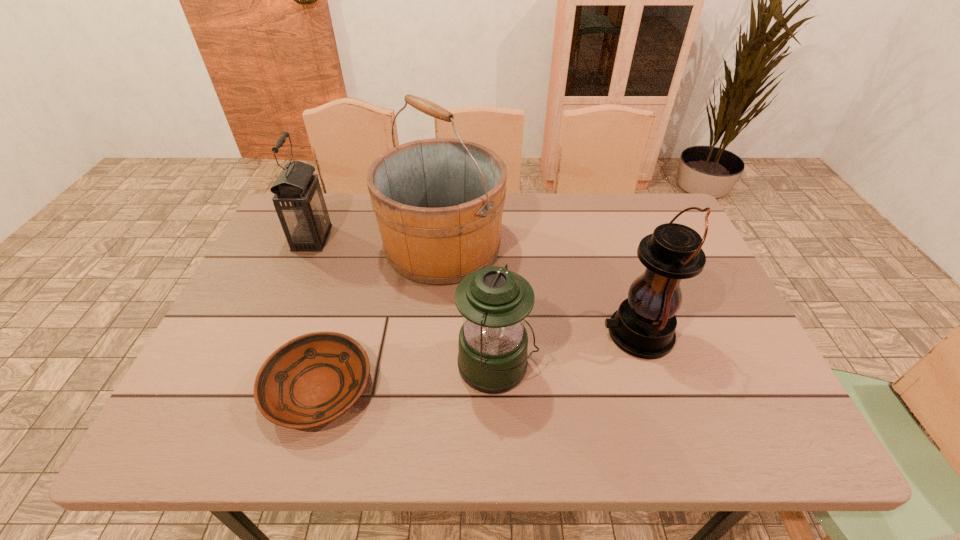
Locate an element on the screen. The height and width of the screenshot is (540, 960). vacant area situated 0.160m on the front-facing side of the leftmost lantern is located at coordinates (386, 238).

What are the coordinates of `free location located on the right of the second lantern from left to right` in the screenshot? It's located at (622, 367).

Find the location of a particular element. Image resolution: width=960 pixels, height=540 pixels. free space located 0.100m on the left of the plate is located at coordinates (217, 389).

At what (x,y) coordinates should I click in order to perform the action: click on bucket located in the far edge section of the desktop. Please return your answer as a coordinate pair (x, y). Looking at the image, I should click on (438, 202).

The height and width of the screenshot is (540, 960). What are the coordinates of `lantern that is at the far edge` in the screenshot? It's located at (298, 199).

Image resolution: width=960 pixels, height=540 pixels. I want to click on object that is at the near edge, so click(313, 379).

Identify the location of lantern that is positioned at the left edge. This screenshot has width=960, height=540. (298, 199).

The image size is (960, 540). Identify the location of plate that is at the left edge. (313, 379).

Where is `object present at the right edge`? object present at the right edge is located at coordinates (644, 325).

Find the location of `object that is at the far left corner`. object that is at the far left corner is located at coordinates (298, 199).